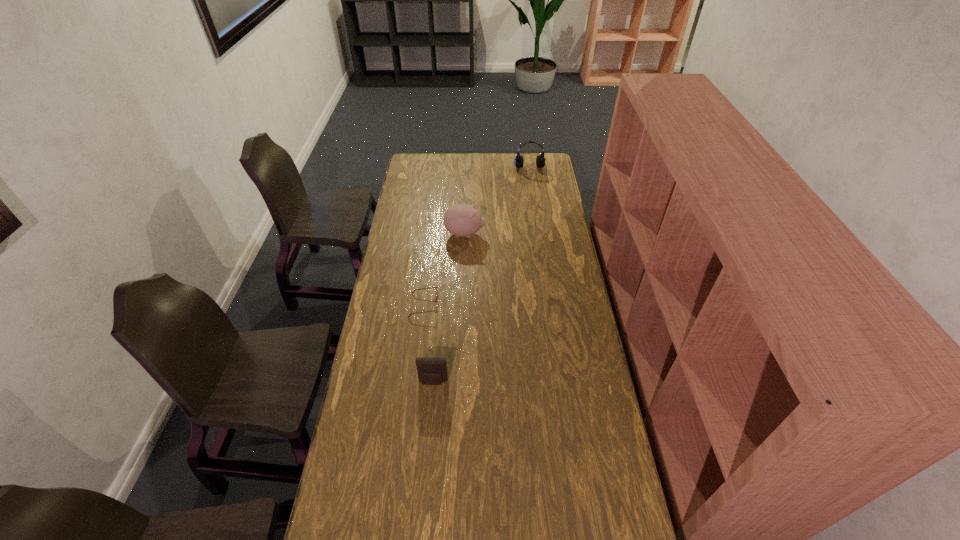
Where is `the rightmost object`? This screenshot has height=540, width=960. the rightmost object is located at coordinates (540, 160).

Locate an element on the screen. the farthest object is located at coordinates (540, 160).

Identify the location of the second farthest object. (462, 220).

This screenshot has height=540, width=960. What are the coordinates of `the nearest object` in the screenshot? It's located at (431, 370).

In order to click on pouch in this screenshot , I will do `click(431, 370)`.

I want to click on the shortest object, so click(431, 287).

I want to click on the third farthest object, so click(x=431, y=287).

Find the location of a particular element. This screenshot has height=540, width=960. free location located on the ear cushions of the rightmost object is located at coordinates (535, 203).

Where is `vacant space situated at the snout of the piggy bank`? Image resolution: width=960 pixels, height=540 pixels. vacant space situated at the snout of the piggy bank is located at coordinates (510, 234).

Locate an element on the screen. Image resolution: width=960 pixels, height=540 pixels. vacant point located with an open flap on the nearest object is located at coordinates (424, 490).